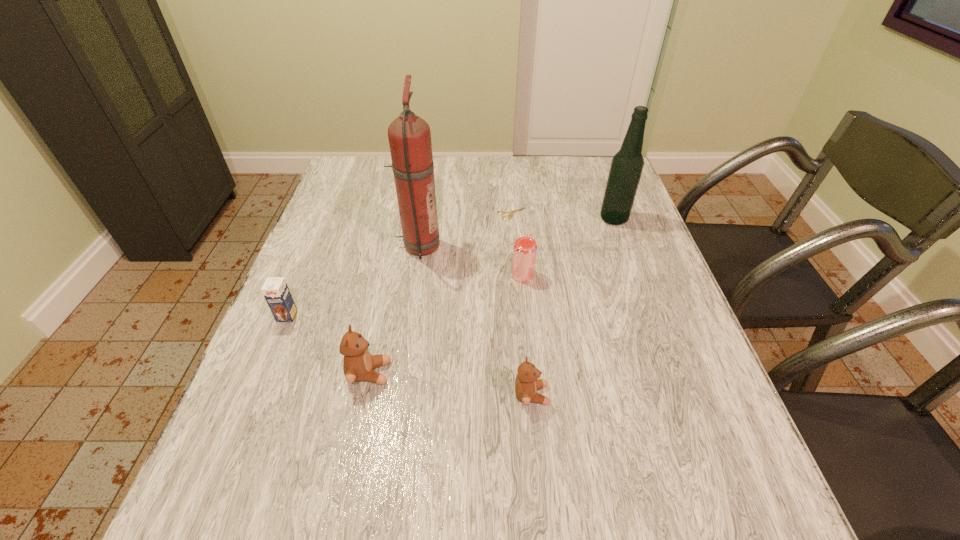
The image size is (960, 540). Find the location of `vacant area that lies between the fourth nearest object and the shorter teddy bear`. vacant area that lies between the fourth nearest object and the shorter teddy bear is located at coordinates (527, 335).

The width and height of the screenshot is (960, 540). Identify the location of free spot between the sixth shortest object and the third farthest object. (516, 233).

Identify the location of free space between the right teddy bear and the fourth nearest object. This screenshot has width=960, height=540. (527, 335).

Locate an element on the screen. object that is the fifth closest to the fourth nearest object is located at coordinates (358, 364).

Where is `object that is the fifth closest to the second tallest object`? This screenshot has height=540, width=960. object that is the fifth closest to the second tallest object is located at coordinates (358, 364).

Where is `vacant space that satisfies the following two spatial constraints: 1. on the front side of the shears; 2. on the front-facing side of the taller teddy bear`? vacant space that satisfies the following two spatial constraints: 1. on the front side of the shears; 2. on the front-facing side of the taller teddy bear is located at coordinates (527, 373).